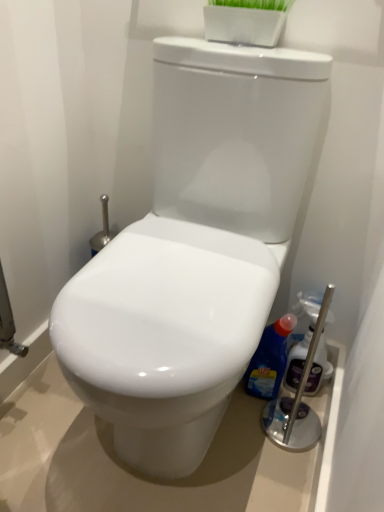
The width and height of the screenshot is (384, 512). In order to click on vacant space in front of blue glossy bottle at right, placed as the 2th cleaning product when sorted from right to left in this screenshot , I will do `click(263, 438)`.